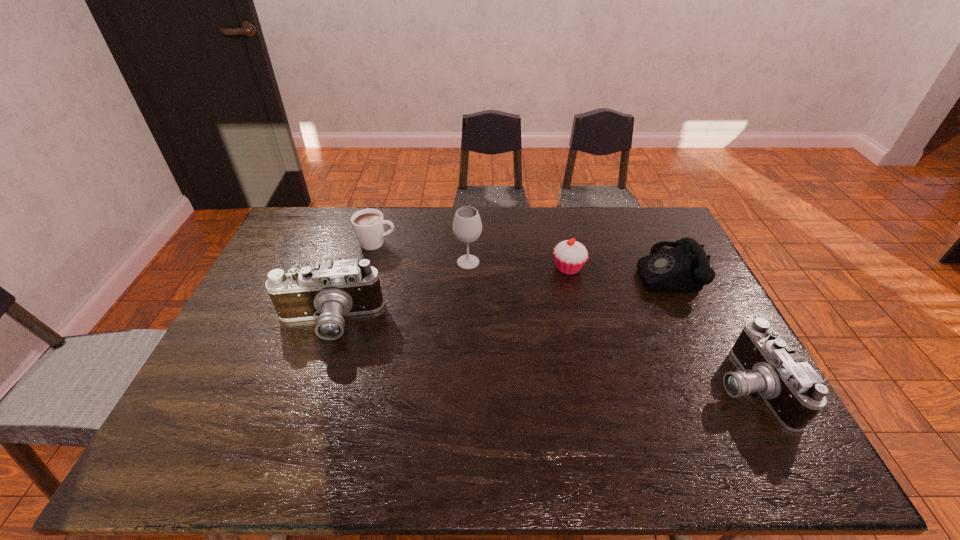
Locate an element on the screen. This screenshot has width=960, height=540. blank area located at the lens of the shorter camera is located at coordinates (676, 386).

Where is `free location located at the lens of the shorter camera`? This screenshot has width=960, height=540. free location located at the lens of the shorter camera is located at coordinates (591, 386).

Where is `free location located 0.180m on the dial of the telephone`? The image size is (960, 540). free location located 0.180m on the dial of the telephone is located at coordinates (581, 271).

Where is `vacant area situated on the dial of the telephone`? The height and width of the screenshot is (540, 960). vacant area situated on the dial of the telephone is located at coordinates (544, 271).

Locate an element on the screen. The image size is (960, 540). vacant space situated 0.160m on the dial of the telephone is located at coordinates (588, 271).

This screenshot has height=540, width=960. I want to click on vacant space located 0.240m on the back of the cupcake, so point(557,217).

What are the coordinates of `vacant area situated with the handle on the side of the cappuccino` in the screenshot? It's located at (468, 243).

The image size is (960, 540). I want to click on free location located 0.350m on the left of the third object from left to right, so click(348, 262).

Identify the location of telephone at the far edge. (685, 268).

Find the location of `cappuccino that is at the far edge`. cappuccino that is at the far edge is located at coordinates (368, 224).